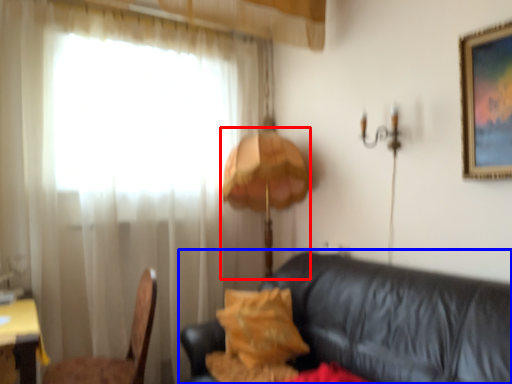
Question: Which of the following is the farthest to the observer, table lamp (highlighted by a red box) or studio couch (highlighted by a blue box)?

Choices:
 (A) table lamp
 (B) studio couch

Answer: (A)